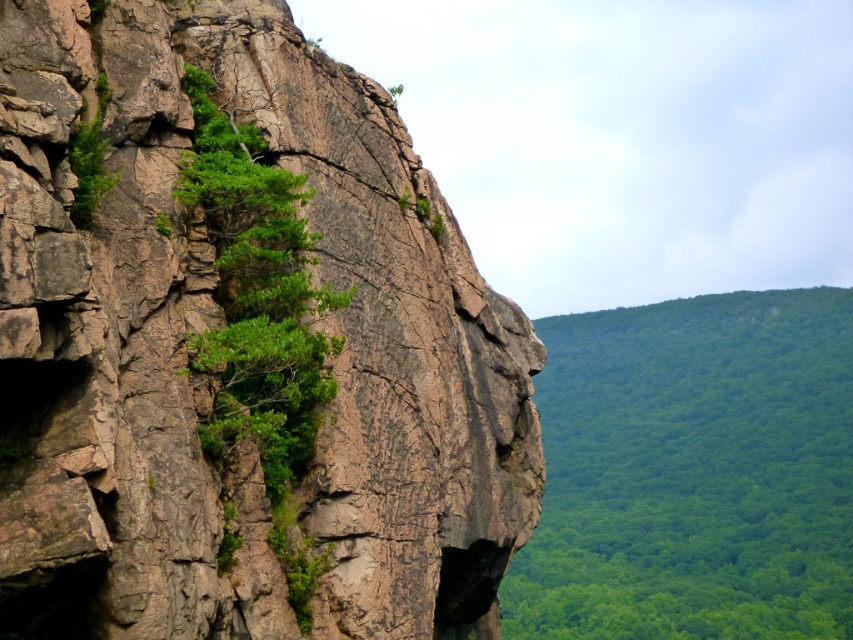
Question: Which point is farther from the camera taking this photo?

Choices:
 (A) (169, 611)
 (B) (224, 122)

Answer: (B)

Question: Is rusty brown rock at center below green leafy tree at right?

Choices:
 (A) yes
 (B) no

Answer: (B)

Question: Is rusty brown rock at center below green leafy tree at right?

Choices:
 (A) no
 (B) yes

Answer: (A)

Question: Which is nearer to the rusty brown rock at center?

Choices:
 (A) green leafy tree at right
 (B) green leafy tree at upper left

Answer: (B)

Question: Which point is farther from the camera taking this photo?

Choices:
 (A) (305, 428)
 (B) (705, 449)
 (C) (141, 314)

Answer: (B)

Question: Does green leafy tree at right appear over green leafy tree at upper left?

Choices:
 (A) yes
 (B) no

Answer: (B)